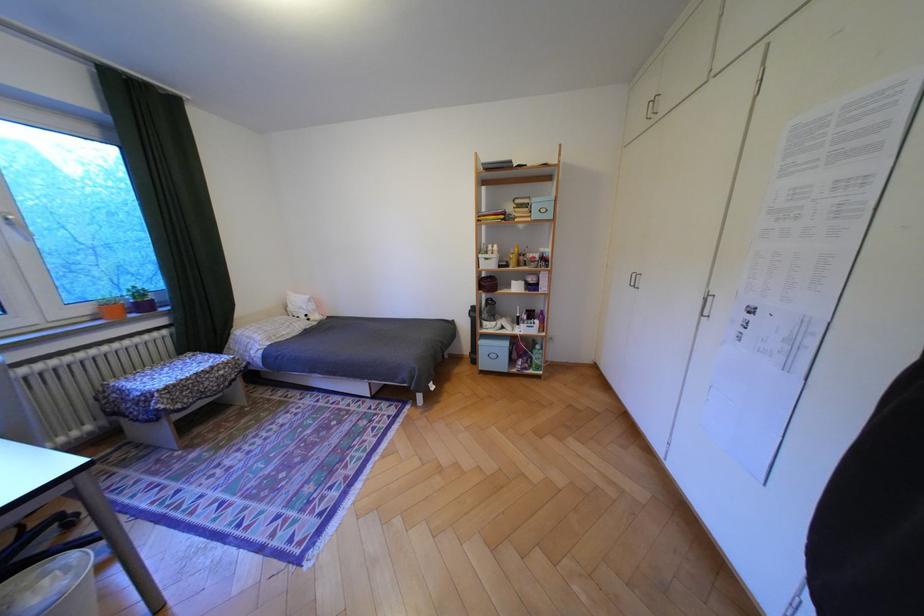
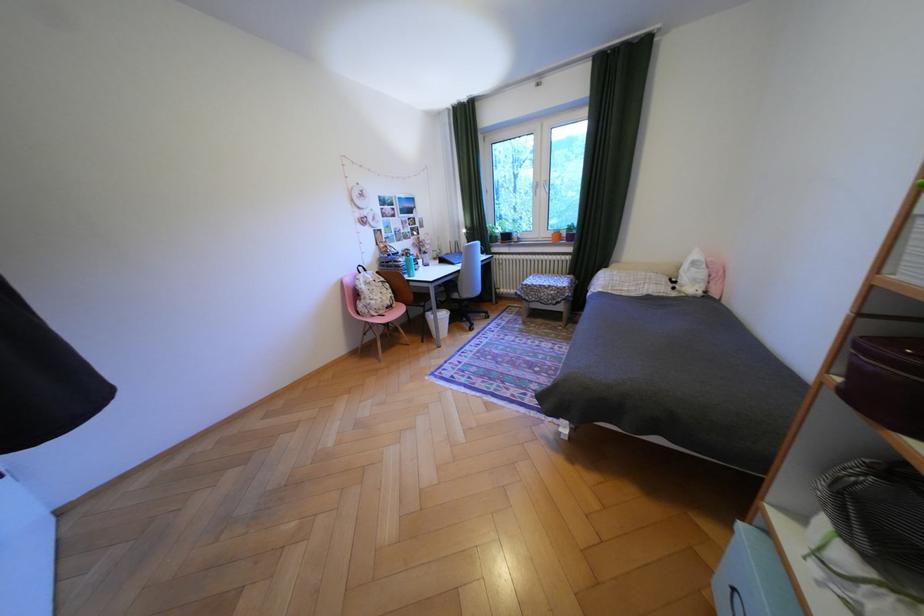
Where in the second image is the point corresponding to [224,368] from the first image?

(562, 286)